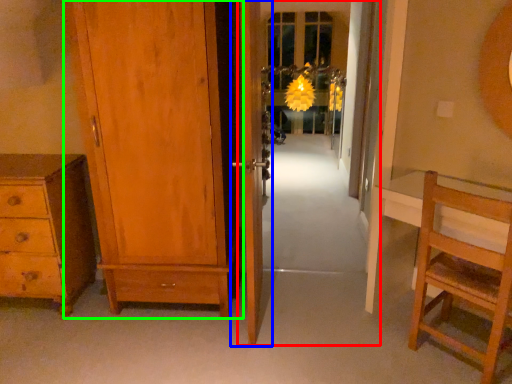
Question: Which object is positioned closest to screen door (highlighted by a red box)? Select from door (highlighted by a blue box) and door (highlighted by a green box).

Choices:
 (A) door
 (B) door

Answer: (A)